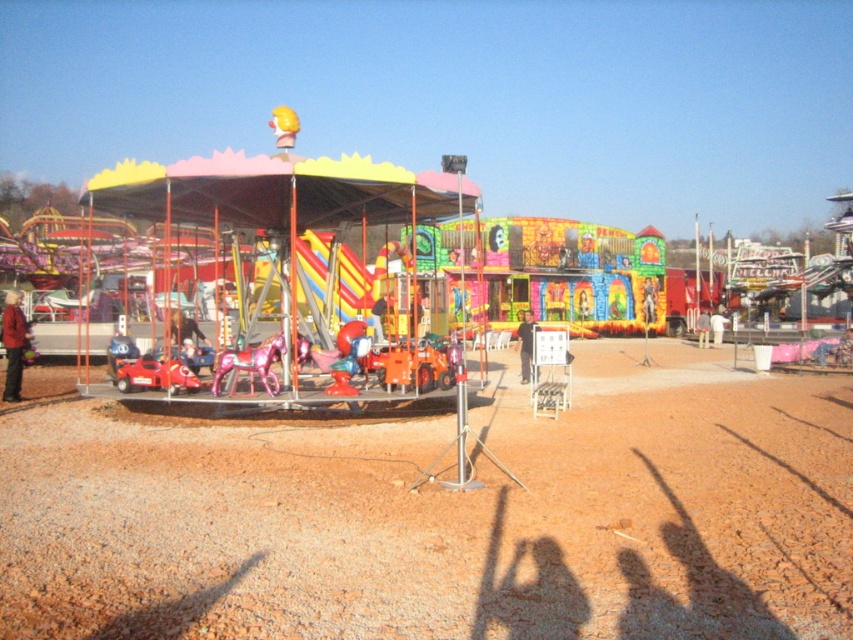
You are standing at the fairground and want to take a photo of both the metallic carousel at center and the black matte person at center. Which object should you focus on first to ensure both are in the frame?

You should focus on the metallic carousel at center first because it is taller than the black matte person at center, so adjusting the camera angle to include its height will naturally include the shorter person in the frame.